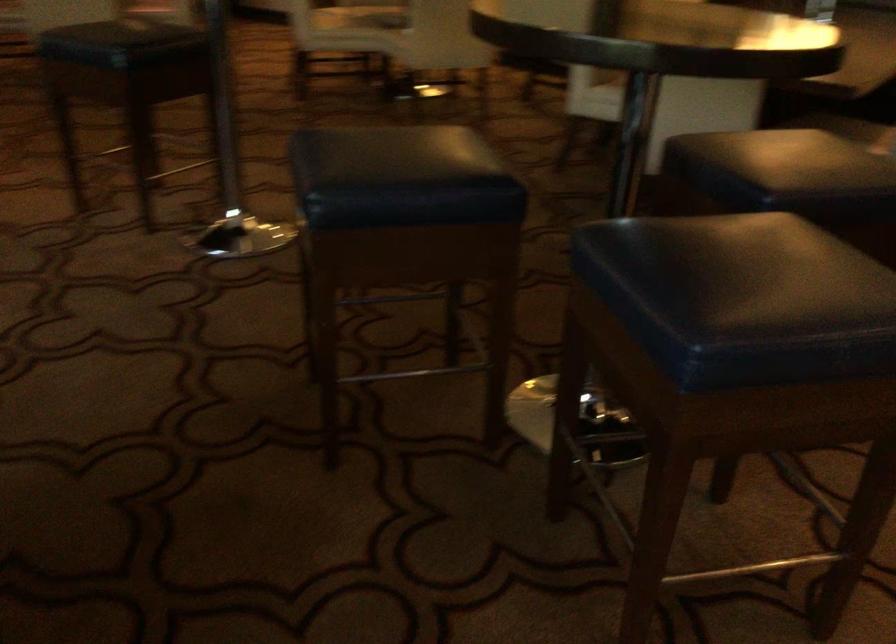
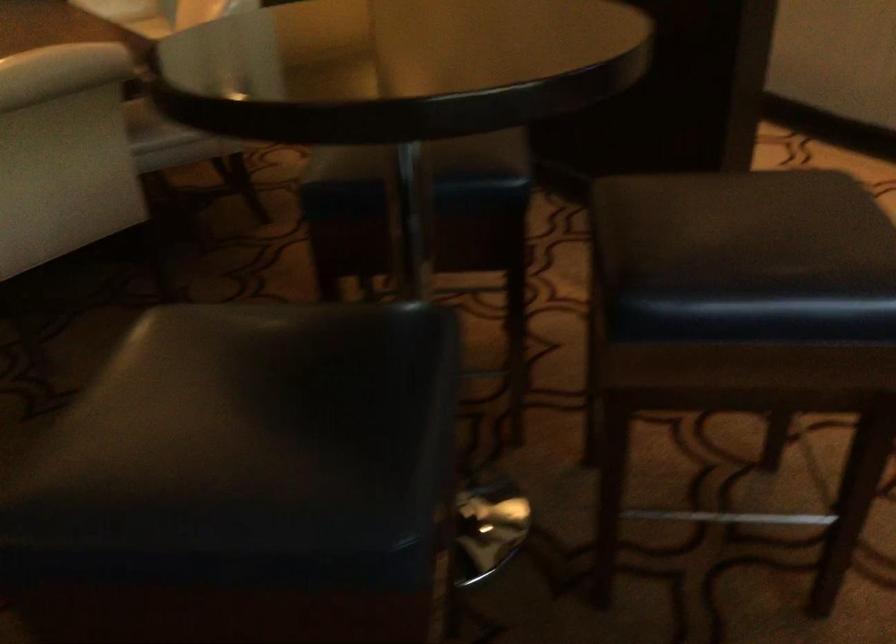
Find the pixel in the second image that matches (x=643, y=256) in the first image.

(745, 257)